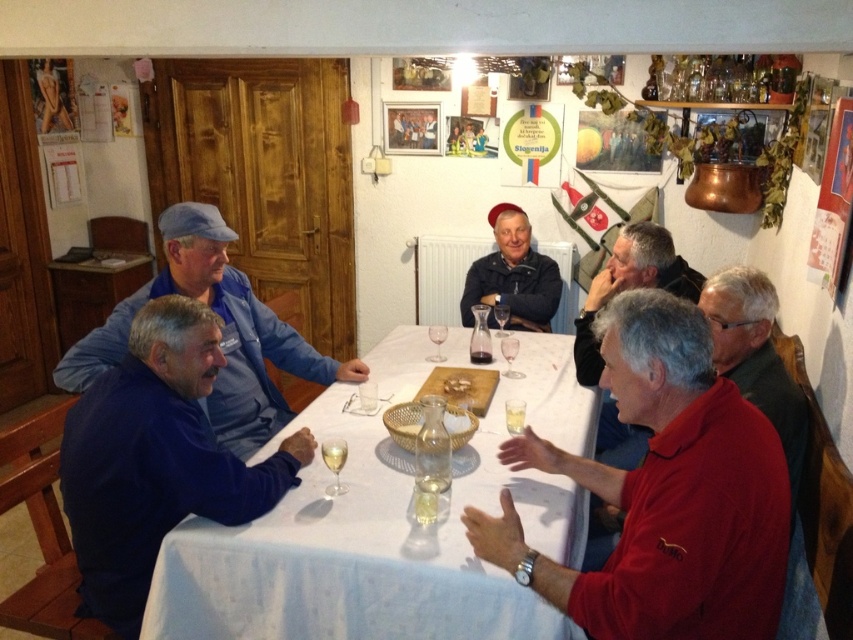
You are a guest at this gathering and want to place your phone on the table without blocking the transparent glass wine glass at center. Considering the blue fleece jacket at lower left is taller than the wine glass, where should you place your phone?

Place your phone on the table away from the blue fleece jacket at lower left and transparent glass wine glass at center. Since the blue fleece jacket at lower left is taller than the wine glass, it might cast a shadow or take up more vertical space, so placing the phone elsewhere ensures it doesn

You are a server at a restaurant and need to deliver a dessert to the table. The dessert needs to be placed on the table away from the blue fleece jacket at lower left and the clear glass wine glass at center. Where should you place the dessert?

The dessert should be placed to the right of the clear glass wine glass at center since the blue fleece jacket at lower left is to the left of the wine glass, leaving space on the right side of the table.

You are a guest at this gathering and want to grab the transparent glass wine glass at center without disturbing the blue fleece jacket at lower left. Is the jacket in the way of the glass?

The blue fleece jacket at lower left is positioned under the transparent glass wine glass at center, so the jacket is not blocking the glass. You can reach the glass without moving the jacket.